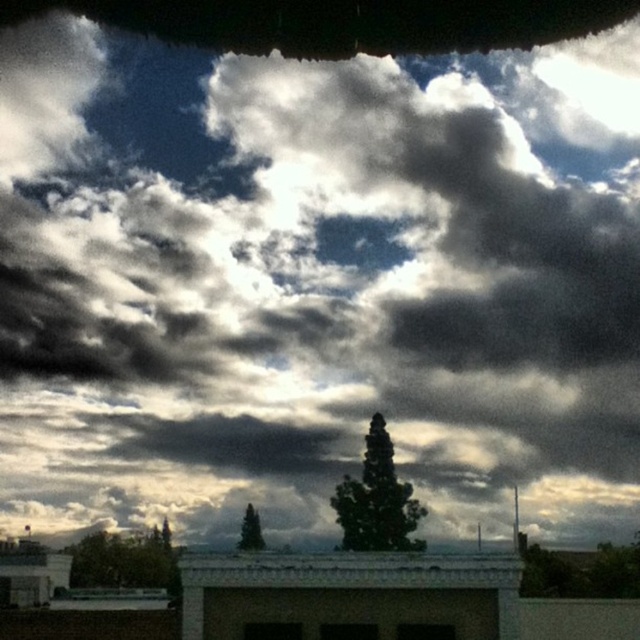
Can you confirm if green leafy tree at center is smaller than green leafy tree at lower left?

Correct, green leafy tree at center occupies less space than green leafy tree at lower left.

Between green leafy tree at center and green leafy tree at lower left, which one appears on the left side from the viewer's perspective?

green leafy tree at lower left is more to the left.

This screenshot has width=640, height=640. In order to click on green leafy tree at center in this screenshot , I will do (376, 500).

Is point (381, 480) positioned before point (253, 528)?

Yes.

Who is lower down, green leafy tree at center or green matte tree at center?

Positioned lower is green matte tree at center.

Is point (396, 547) in front of point (237, 547)?

Yes, it is in front of point (237, 547).

I want to click on green leafy tree at center, so click(x=376, y=500).

How distant is green leafy tree at lower right from green matte tree at center?

green leafy tree at lower right and green matte tree at center are 14.05 meters apart from each other.

You are a GUI agent. You are given a task and a screenshot of the screen. Output one action in this format:
    pyautogui.click(x=<x>, y=<y>)
    Task: Click on the green leafy tree at lower right
    This screenshot has width=640, height=640.
    Given the screenshot: What is the action you would take?
    pyautogui.click(x=580, y=570)

Who is more forward, (541, 582) or (260, 538)?

Positioned in front is point (541, 582).

I want to click on green leafy tree at lower right, so click(580, 570).